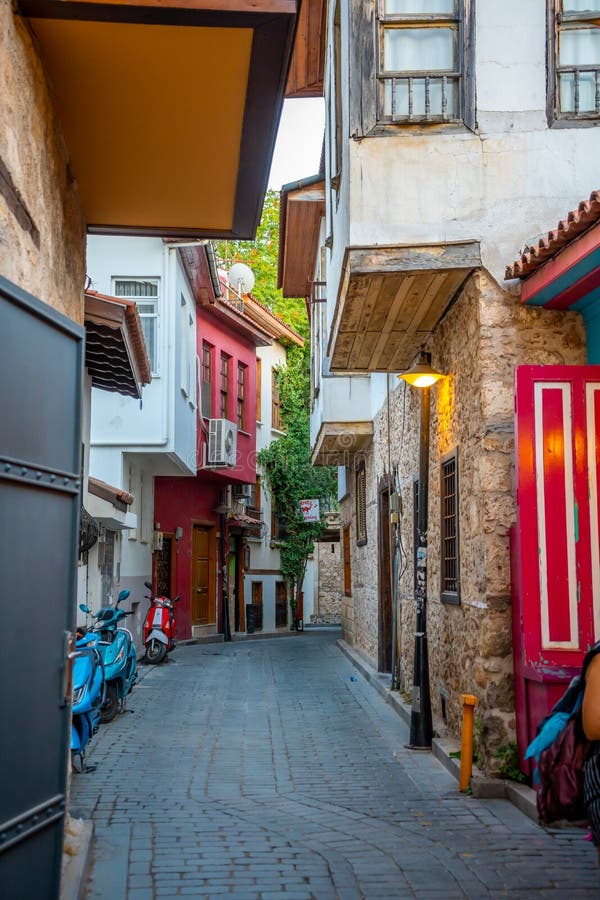
Image resolution: width=600 pixels, height=900 pixels. Identify the location of window. (142, 302).